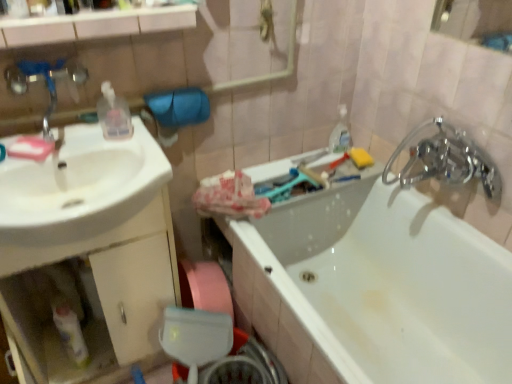
Question: Could brushed metal faucet at upper left be considered to be inside chrome metallic faucet at upper right?

Choices:
 (A) no
 (B) yes

Answer: (A)

Question: Is chrome metallic faucet at upper right facing towards brushed metal faucet at upper left?

Choices:
 (A) yes
 (B) no

Answer: (A)

Question: Can you confirm if chrome metallic faucet at upper right is positioned to the right of brushed metal faucet at upper left?

Choices:
 (A) no
 (B) yes

Answer: (B)

Question: Is chrome metallic faucet at upper right turned away from brushed metal faucet at upper left?

Choices:
 (A) yes
 (B) no

Answer: (B)

Question: From a real-world perspective, is chrome metallic faucet at upper right on brushed metal faucet at upper left?

Choices:
 (A) no
 (B) yes

Answer: (A)

Question: Are chrome metallic faucet at upper right and brushed metal faucet at upper left located far from each other?

Choices:
 (A) no
 (B) yes

Answer: (B)

Question: Can you confirm if white glossy sink at left is positioned to the right of brushed metal faucet at upper left?

Choices:
 (A) no
 (B) yes

Answer: (B)

Question: From the image's perspective, is white glossy sink at left on brushed metal faucet at upper left?

Choices:
 (A) yes
 (B) no

Answer: (B)

Question: Can you confirm if white glossy sink at left is shorter than brushed metal faucet at upper left?

Choices:
 (A) no
 (B) yes

Answer: (A)

Question: Is white glossy sink at left surrounding brushed metal faucet at upper left?

Choices:
 (A) no
 (B) yes

Answer: (A)

Question: From the image's perspective, is white glossy sink at left beneath brushed metal faucet at upper left?

Choices:
 (A) yes
 (B) no

Answer: (A)

Question: Is white glossy sink at left turned away from brushed metal faucet at upper left?

Choices:
 (A) no
 (B) yes

Answer: (A)

Question: Considering the relative positions of chrome metallic faucet at upper right and transparent plastic bottle at upper left, acting as the first bottle starting from the right, in the image provided, is chrome metallic faucet at upper right behind transparent plastic bottle at upper left, acting as the first bottle starting from the right,?

Choices:
 (A) yes
 (B) no

Answer: (B)